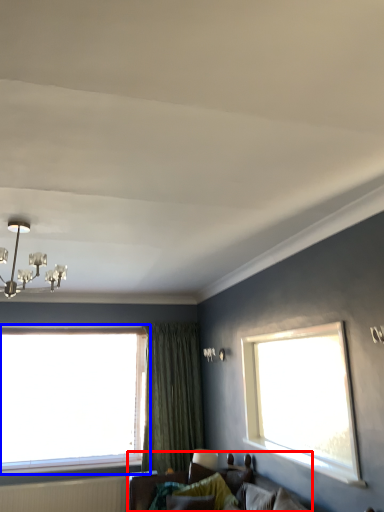
Question: Which of the following is the closest to the observer, studio couch (highlighted by a red box) or window (highlighted by a blue box)?

Choices:
 (A) studio couch
 (B) window

Answer: (A)